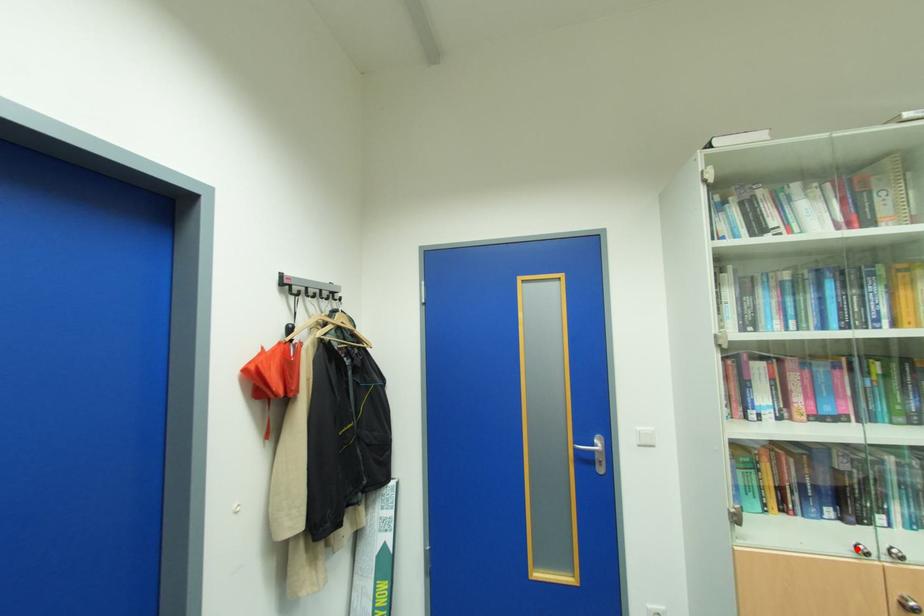
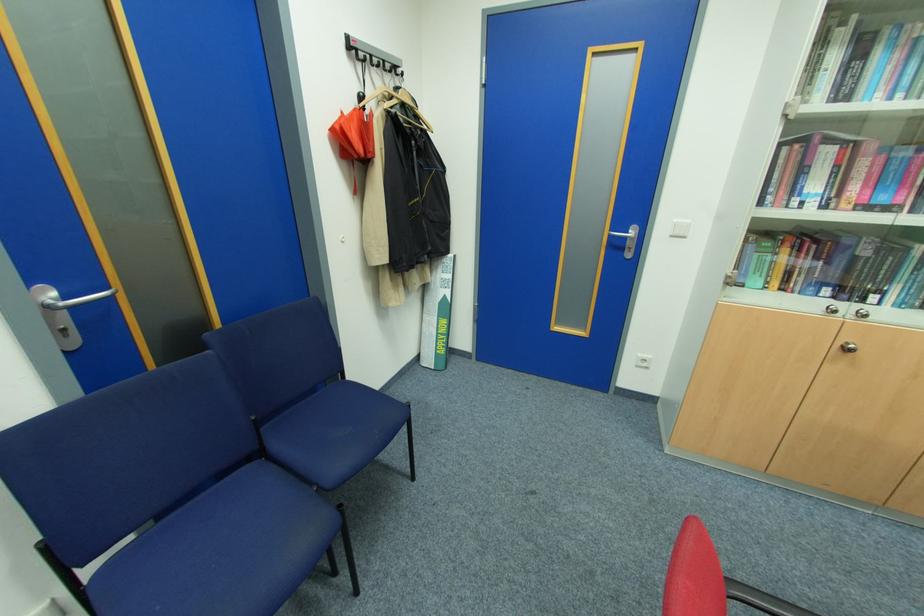
The point at the highlighted location is marked in the first image. Where is the corresponding point in the second image?

(830, 310)